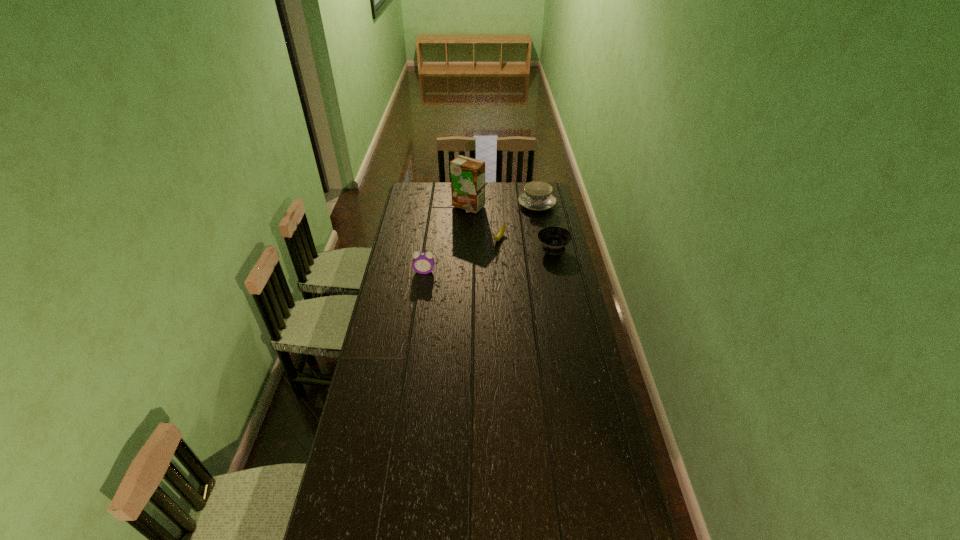
Locate an element on the screen. vacant space located with the handle on the side of the chinaware is located at coordinates (507, 233).

Where is `free space located with the handle on the side of the chinaware`? The width and height of the screenshot is (960, 540). free space located with the handle on the side of the chinaware is located at coordinates (516, 225).

Identify the location of vacant space situated 0.250m on the straw side of the carton. pyautogui.click(x=479, y=240).

Locate an element on the screen. The height and width of the screenshot is (540, 960). free space located 0.100m on the straw side of the carton is located at coordinates pyautogui.click(x=474, y=224).

Locate an element on the screen. The width and height of the screenshot is (960, 540). free region located on the straw side of the carton is located at coordinates (485, 254).

You are a GUI agent. You are given a task and a screenshot of the screen. Output one action in this format:
    pyautogui.click(x=<x>, y=<y>)
    Task: Click on the vacant area situated 0.180m at the stem of the banana
    This screenshot has height=540, width=960.
    Given the screenshot: What is the action you would take?
    pyautogui.click(x=483, y=267)

Image resolution: width=960 pixels, height=540 pixels. In order to click on free space located at the stem of the banana in this screenshot , I will do `click(488, 259)`.

You are a GUI agent. You are given a task and a screenshot of the screen. Output one action in this format:
    pyautogui.click(x=<x>, y=<y>)
    Task: Click on the free point located 0.170m at the stem of the banana
    This screenshot has width=960, height=540.
    Given the screenshot: What is the action you would take?
    pyautogui.click(x=484, y=266)

Find the location of a particular element. chinaware located in the far edge section of the desktop is located at coordinates (537, 196).

At what (x,y) coordinates should I click in order to perform the action: click on carton situated at the far edge. Please return your answer as a coordinate pair (x, y). Image resolution: width=960 pixels, height=540 pixels. Looking at the image, I should click on (467, 174).